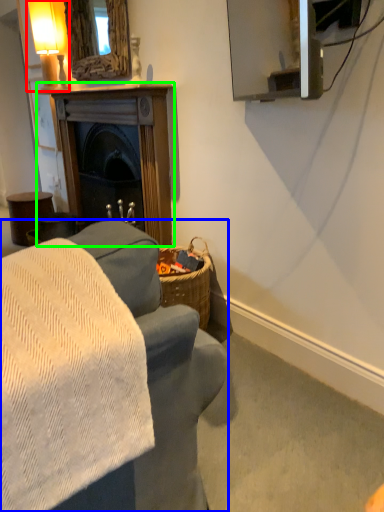
Question: Which object is positioned farthest from table lamp (highlighted by a red box)? Select from studio couch (highlighted by a blue box) and fireplace (highlighted by a green box).

Choices:
 (A) studio couch
 (B) fireplace

Answer: (A)